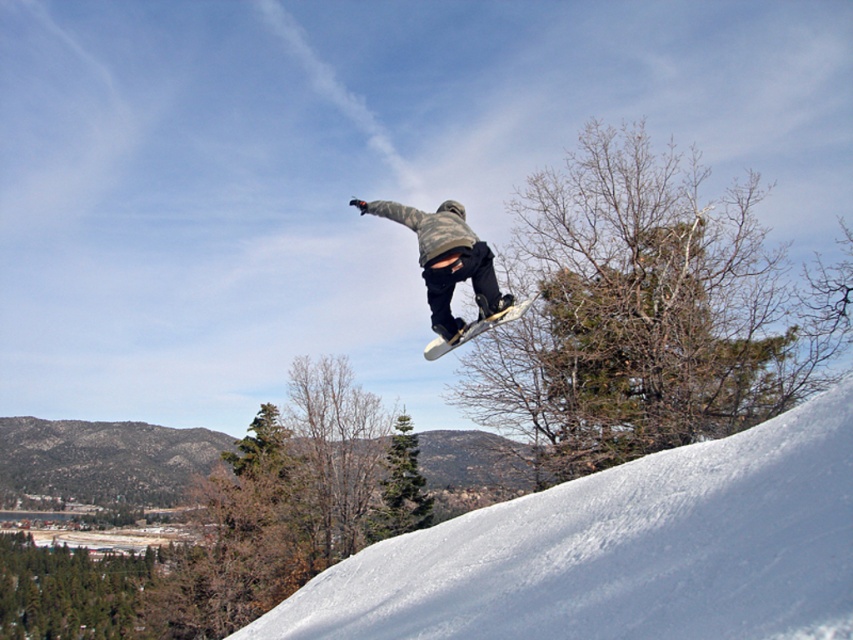
Does camouflage fabric snowboarder at center have a greater height compared to white matte snowboard at center?

Correct, camouflage fabric snowboarder at center is much taller as white matte snowboard at center.

Can you confirm if camouflage fabric snowboarder at center is positioned above white matte snowboard at center?

Yes.

Which is in front, point (450, 333) or point (514, 308)?

Positioned in front is point (450, 333).

Find the location of `camouflage fabric snowboarder at center`. camouflage fabric snowboarder at center is located at coordinates (445, 260).

Looking at this image, can you confirm if white snow at lower right is thinner than camouflage fabric snowboarder at center?

In fact, white snow at lower right might be wider than camouflage fabric snowboarder at center.

Does white snow at lower right appear on the left side of camouflage fabric snowboarder at center?

No, white snow at lower right is not to the left of camouflage fabric snowboarder at center.

Identify the location of white snow at lower right. (622, 550).

The image size is (853, 640). Identify the location of white snow at lower right. (622, 550).

Is point (758, 593) in front of point (486, 317)?

Yes.

Does point (781, 556) lie behind point (524, 310)?

No.

Where is `white snow at lower right`? This screenshot has height=640, width=853. white snow at lower right is located at coordinates (622, 550).